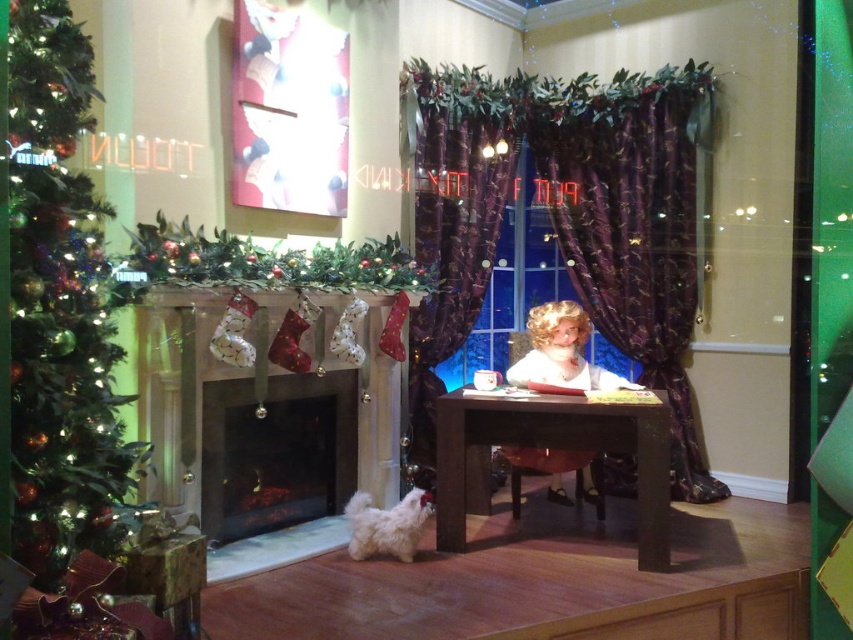
Is point (497, 129) closer to viewer compared to point (440, 480)?

No.

Based on the photo, is purple velvet curtains at center bigger than brown wooden table at center?

Yes.

Image resolution: width=853 pixels, height=640 pixels. Identify the location of purple velvet curtains at center. [x=451, y=218].

Does green textured christmas tree at left appear on the right side of purple velvet curtains at center?

Incorrect, green textured christmas tree at left is not on the right side of purple velvet curtains at center.

Is point (22, 458) less distant than point (519, 140)?

Yes, it is.

What are the coordinates of `green textured christmas tree at left` in the screenshot? It's located at (59, 308).

Does purple satin curtains at center appear on the right side of green textured christmas tree at left?

Indeed, purple satin curtains at center is positioned on the right side of green textured christmas tree at left.

You are a GUI agent. You are given a task and a screenshot of the screen. Output one action in this format:
    pyautogui.click(x=<x>, y=<y>)
    Task: Click on the purple satin curtains at center
    Image resolution: width=853 pixels, height=640 pixels.
    Given the screenshot: What is the action you would take?
    pyautogui.click(x=567, y=218)

Does point (592, 193) come closer to viewer compared to point (33, 353)?

No.

The height and width of the screenshot is (640, 853). Identify the location of purple satin curtains at center. 567,218.